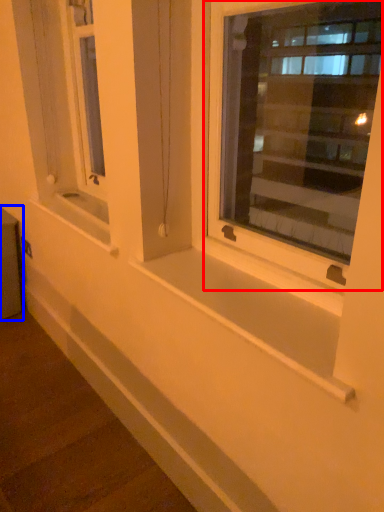
Question: Among these objects, which one is farthest to the camera, window (highlighted by a red box) or window box (highlighted by a blue box)?

Choices:
 (A) window
 (B) window box

Answer: (B)